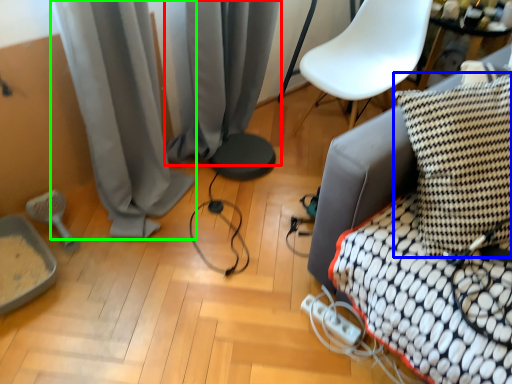
Question: Which object is positioned farthest from curtain (highlighted by a red box)? Select from pillow (highlighted by a blue box) and curtain (highlighted by a green box).

Choices:
 (A) pillow
 (B) curtain

Answer: (A)